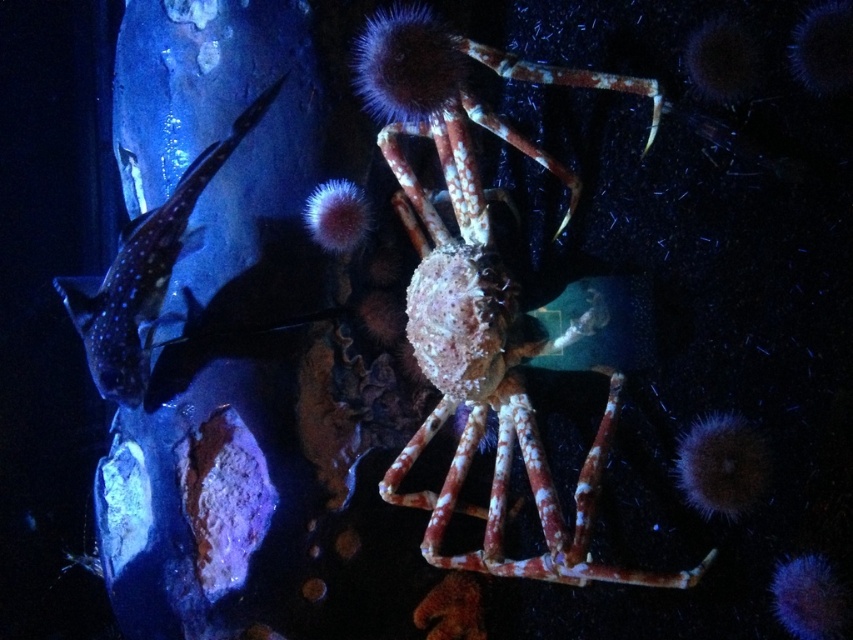
You are a marine biologist observing the underwater scene. You need to determine which creature has a greater width between the speckled orange crab at center and the shiny blue fish at left. Can you identify which one is wider?

The speckled orange crab at center has a greater width than the shiny blue fish at left according to the description.

You are a marine biologist observing an underwater scene. You notice a speckled orange crab at center and a shiny blue fish at left. Which creature has a bigger body size?

The speckled orange crab at center is larger in size than the shiny blue fish at left, so the crab has a bigger body size.

You are a marine biologist studying underwater life. You observe a point at coordinates point (x=480, y=296) in the image. What organism is located at this point?

The point (x=480, y=296) indicates a speckled orange crab at center.